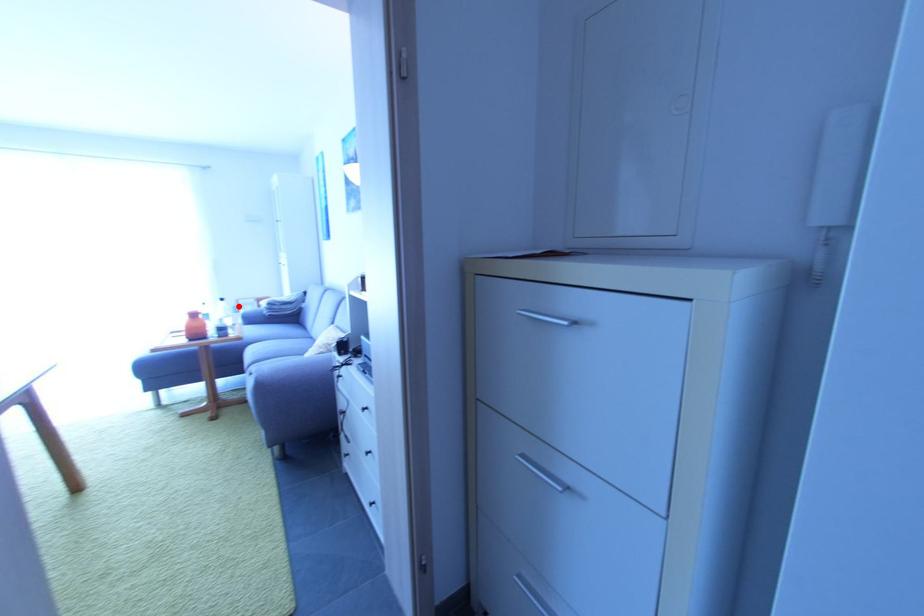
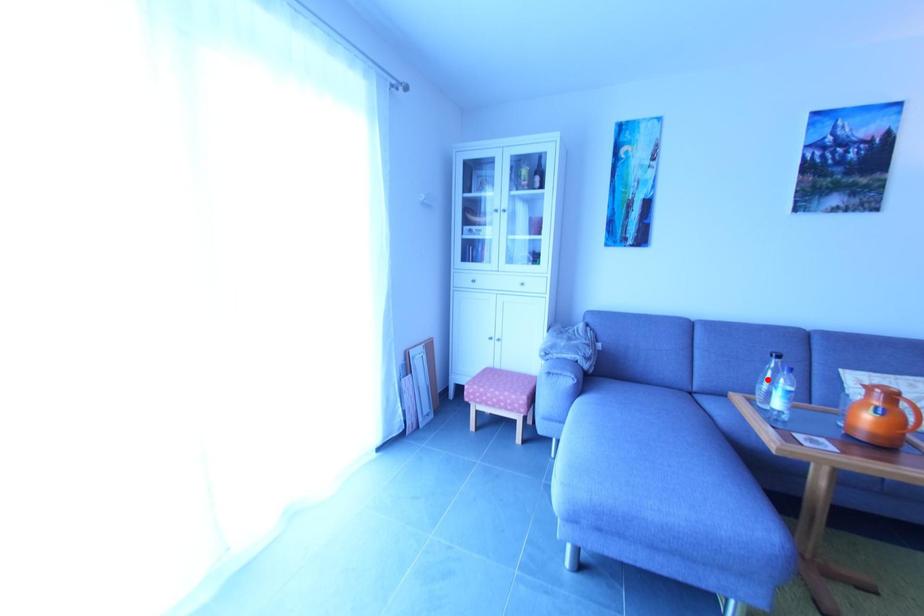
I am providing you with two images of the same scene from different viewpoints. A red point is marked on the first image and another point is marked on the second image. Are the points marked in image1 and image2 representing the same 3D position?

No